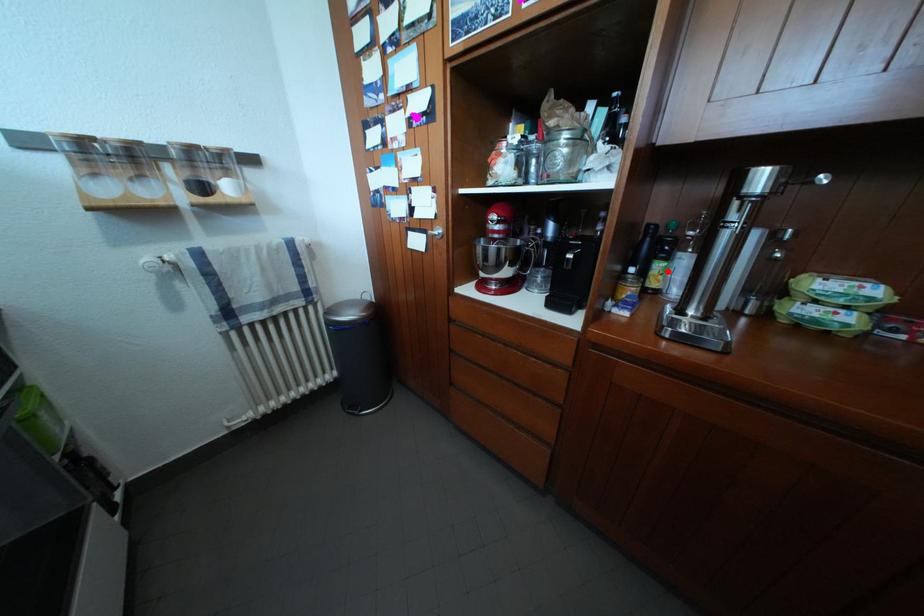
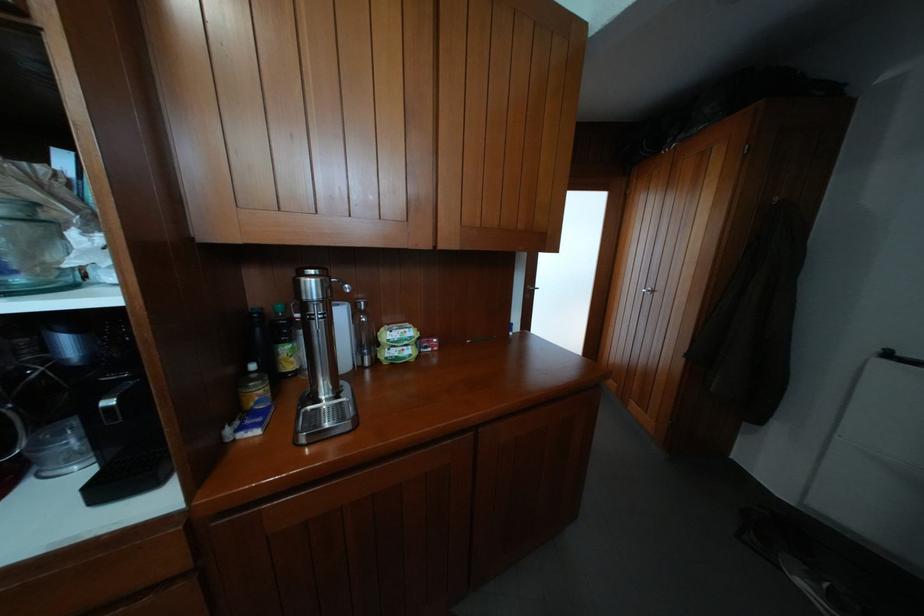
Locate, in the second image, the point that corresponds to the highlighted location in the first image.

(293, 355)